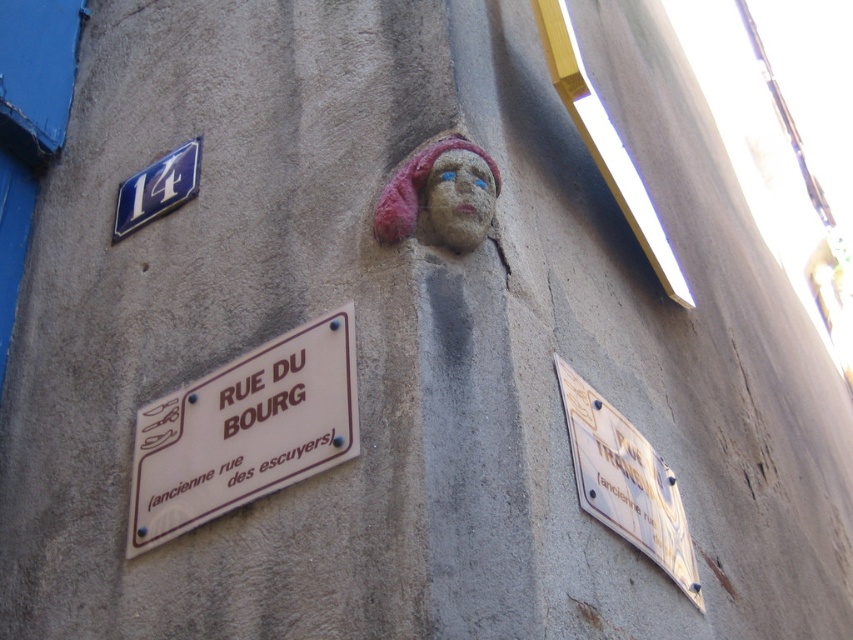
Question: Observing the image, what is the correct spatial positioning of stone face at upper center in reference to blue metallic sign at upper left?

Choices:
 (A) left
 (B) right

Answer: (B)

Question: Which of the following is the closest to the observer?

Choices:
 (A) blue metallic sign at upper left
 (B) stone face at upper center
 (C) white plastic sign at lower right

Answer: (C)

Question: Does white plastic sign at lower left have a smaller size compared to stone face at upper center?

Choices:
 (A) no
 (B) yes

Answer: (A)

Question: Is stone face at upper center to the left of blue metallic sign at upper left from the viewer's perspective?

Choices:
 (A) no
 (B) yes

Answer: (A)

Question: Which point appears farthest from the camera in this image?

Choices:
 (A) (474, 202)
 (B) (692, 582)
 (C) (160, 196)
 (D) (335, 461)

Answer: (C)

Question: Which object appears closest to the camera in this image?

Choices:
 (A) white plastic sign at lower right
 (B) stone face at upper center
 (C) white plastic sign at lower left
 (D) blue metallic sign at upper left

Answer: (C)